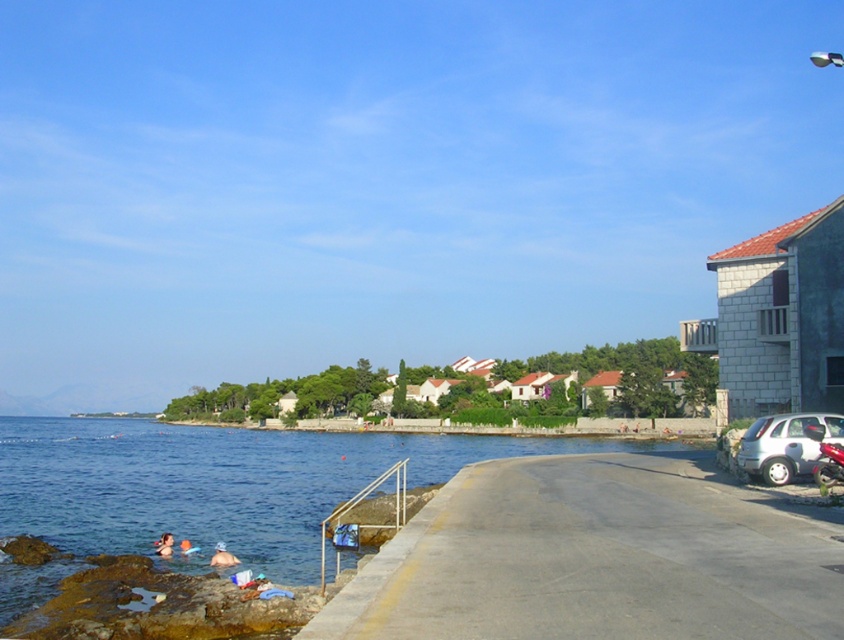
You are standing on the paved walkway in the coastal scene and want to take a photo of the blue water at lower left and the white fabric swimmer at lower left. Which object should you focus on first if you want to capture both in one shot without moving the camera?

The blue water at lower left is closer to the viewer than the white fabric swimmer at lower left, so you should focus on the blue water at lower left first to ensure both are in focus.

You are driving a car and see the image. You need to park your car near the blue water at lower left without blocking the silver metallic hatchback at lower right. Is the parking spot available for your car?

The blue water at lower left is positioned under the silver metallic hatchback at lower right, so parking near the blue water at lower left would likely block the silver metallic hatchback at lower right. Therefore, the parking spot is not available.

Consider the image. You are standing at the point closer to you between the two points, point (x=154, y=512) and point (x=222, y=552), in the coastal scene. If you walk straight ahead, will you move towards the water or away from it?

Point (x=154, y=512) is further to the viewer than point (x=222, y=552). If you are standing at the closer point, walking straight ahead would take you away from the water since the path curves towards the right and the water is in the foreground.